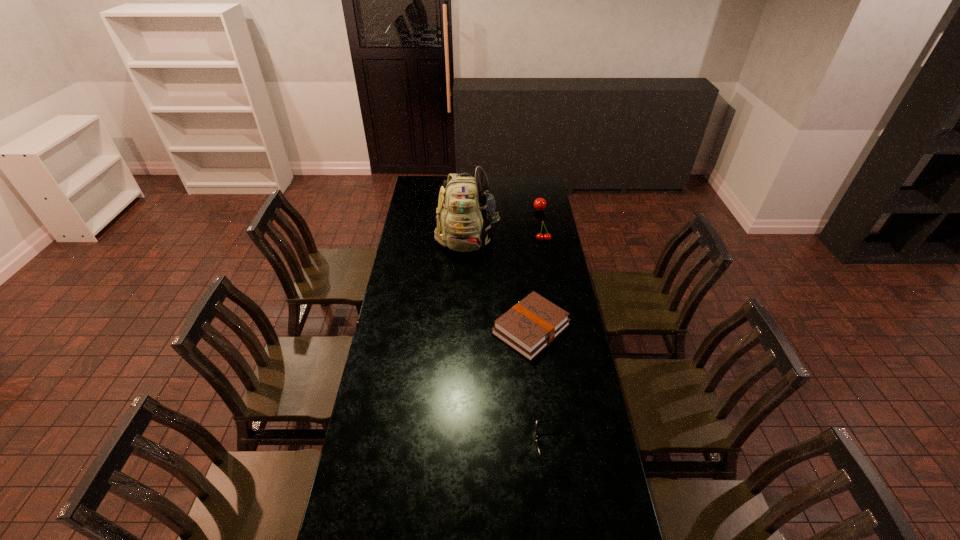
At what (x,y) coordinates should I click in order to perform the action: click on vacant area that lies between the farthest object and the nearer cherry. Please return your answer as a coordinate pair (x, y). Looking at the image, I should click on (541, 225).

The width and height of the screenshot is (960, 540). In order to click on vacant space that is in between the nearer cherry and the hardback book in this screenshot , I will do `click(537, 285)`.

The height and width of the screenshot is (540, 960). In order to click on object that is the fourth nearest to the third tallest object in this screenshot , I will do `click(537, 421)`.

At what (x,y) coordinates should I click in order to perform the action: click on object identified as the third closest to the nearest object. Please return your answer as a coordinate pair (x, y). Looking at the image, I should click on (539, 237).

At what (x,y) coordinates should I click in order to perform the action: click on vacant position in the image that satisfies the following two spatial constraints: 1. on the back side of the second nearest object; 2. on the left side of the farther cherry. Please return your answer as a coordinate pair (x, y). Looking at the image, I should click on (517, 211).

Locate an element on the screen. vacant area in the image that satisfies the following two spatial constraints: 1. on the front side of the farther cherry; 2. on the front-facing side of the nearest object is located at coordinates (582, 446).